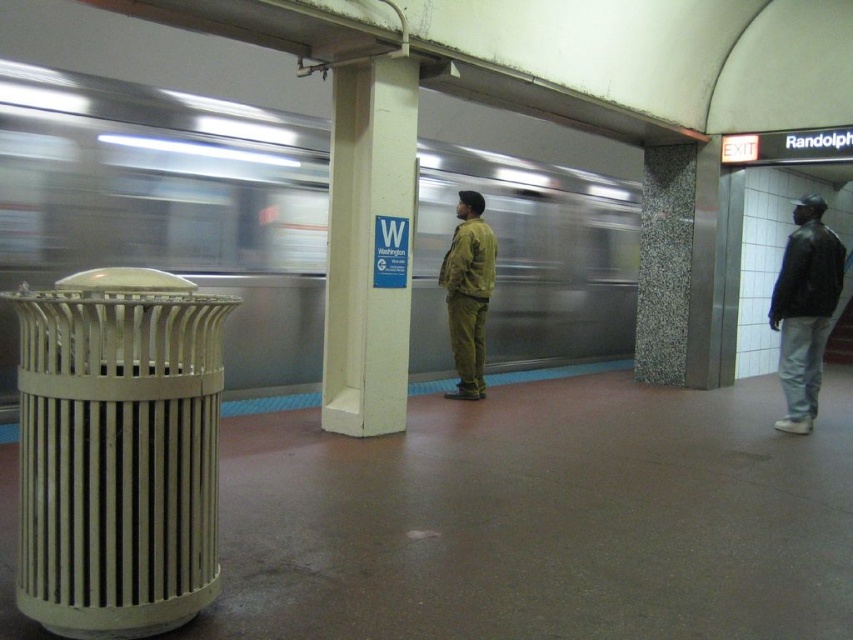
Who is positioned more to the right, white concrete pillar at center or black leather jacket at right?

black leather jacket at right

Between white concrete pillar at center and black leather jacket at right, which one is positioned lower?

Positioned lower is black leather jacket at right.

Describe the element at coordinates (369, 246) in the screenshot. I see `white concrete pillar at center` at that location.

You are a GUI agent. You are given a task and a screenshot of the screen. Output one action in this format:
    pyautogui.click(x=<x>, y=<y>)
    Task: Click on the white concrete pillar at center
    
    Given the screenshot: What is the action you would take?
    pyautogui.click(x=369, y=246)

Is white concrete pillar at center bigger than granite pillar at center?

No.

Which of these two, white concrete pillar at center or granite pillar at center, stands taller?

granite pillar at center

Which is in front, point (379, 236) or point (657, 298)?

Positioned in front is point (379, 236).

In order to click on white concrete pillar at center in this screenshot , I will do `click(369, 246)`.

Who is more forward, (642, 310) or (813, 388)?

Positioned in front is point (813, 388).

Who is positioned more to the left, granite pillar at center or black leather jacket at right?

granite pillar at center is more to the left.

Does point (666, 188) come farther from viewer compared to point (811, 292)?

Yes.

Identify the location of granite pillar at center. This screenshot has height=640, width=853. (665, 262).